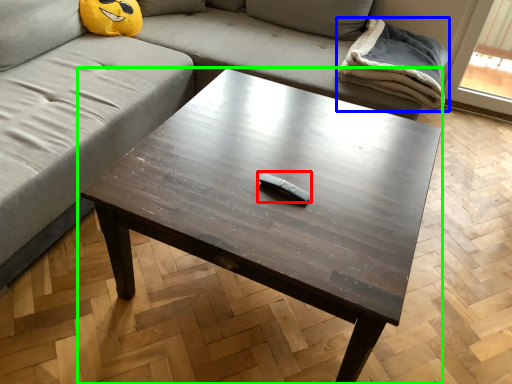
Question: Which object is the closest to the Wii controller (highlighted by a red box)? Choose among these: blanket (highlighted by a blue box) or coffee table (highlighted by a green box).

Choices:
 (A) blanket
 (B) coffee table

Answer: (B)